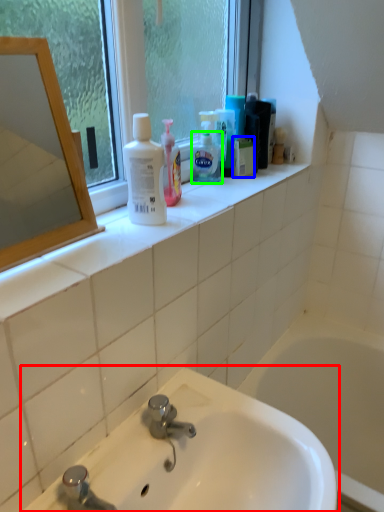
Question: Which object is the farthest from sink (highlighted by a red box)? Choose among these: mouthwash (highlighted by a blue box) or shaving cream (highlighted by a green box).

Choices:
 (A) mouthwash
 (B) shaving cream

Answer: (A)